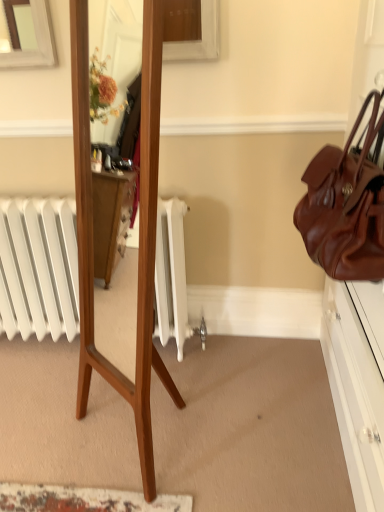
What do you see at coordinates (346, 206) in the screenshot? I see `brown leather handbag at right` at bounding box center [346, 206].

Where is `brown leather handbag at right`? The image size is (384, 512). brown leather handbag at right is located at coordinates (346, 206).

The image size is (384, 512). What are the coordinates of `brown leather handbag at right` in the screenshot? It's located at (346, 206).